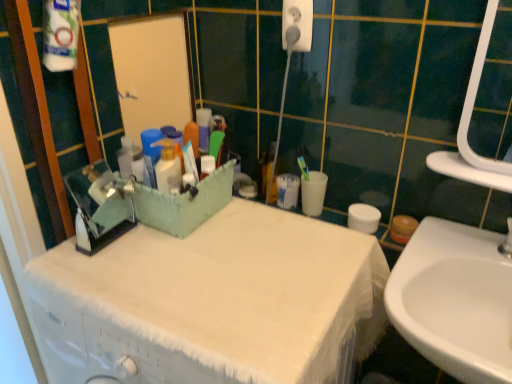
Question: From the image's perspective, is white plastic electric outlet at upper center located above or below white glossy sink at lower right?

Choices:
 (A) below
 (B) above

Answer: (B)

Question: Does point (310, 6) appear closer or farther from the camera than point (448, 352)?

Choices:
 (A) closer
 (B) farther

Answer: (B)

Question: Based on their relative distances, which object is nearer to the white fabric-covered cabinet at center?

Choices:
 (A) white glossy sink at lower right
 (B) white plastic electric outlet at upper center

Answer: (A)

Question: Which is farther from the white fabric-covered cabinet at center?

Choices:
 (A) white glossy sink at lower right
 (B) white plastic electric outlet at upper center

Answer: (B)